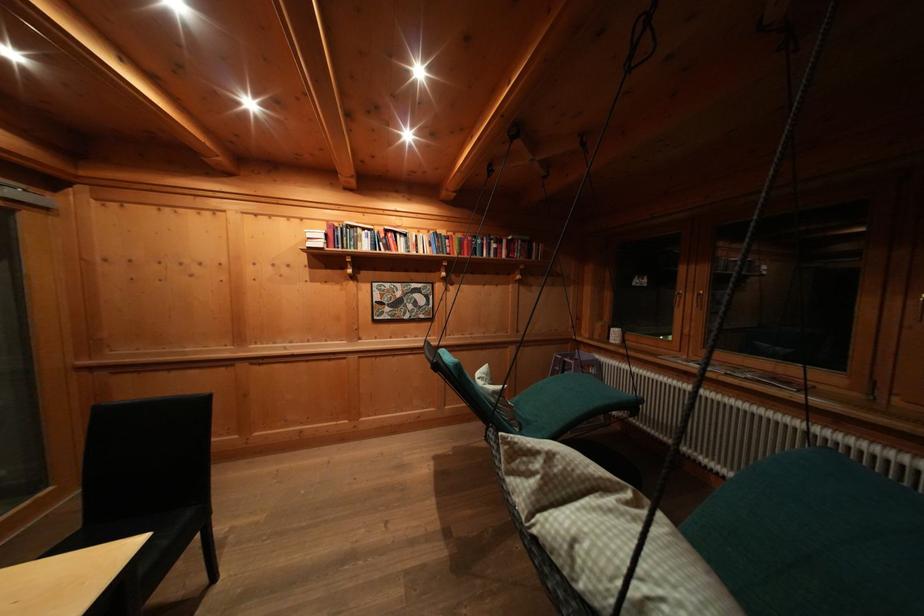
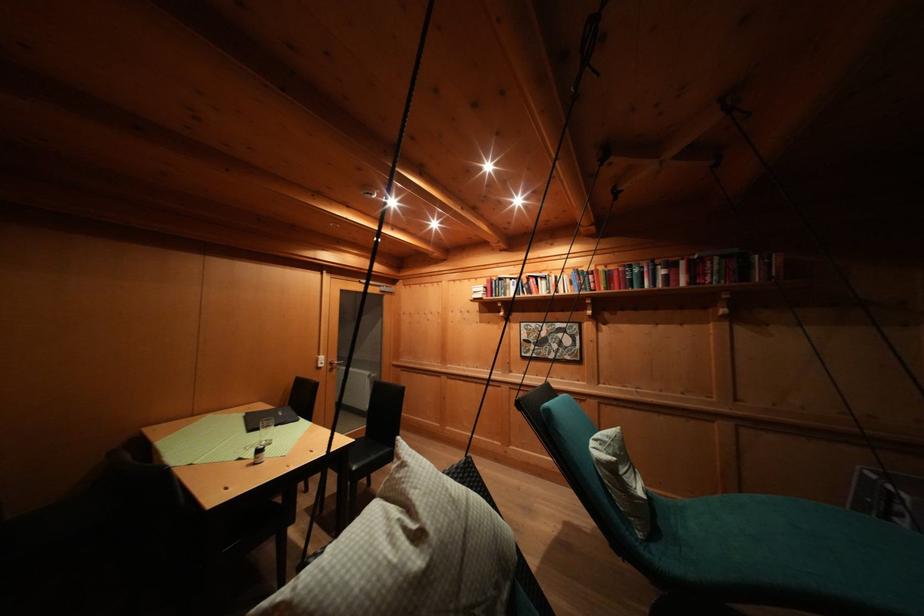
The point at (484, 383) is marked in the first image. Where is the corresponding point in the second image?

(602, 445)